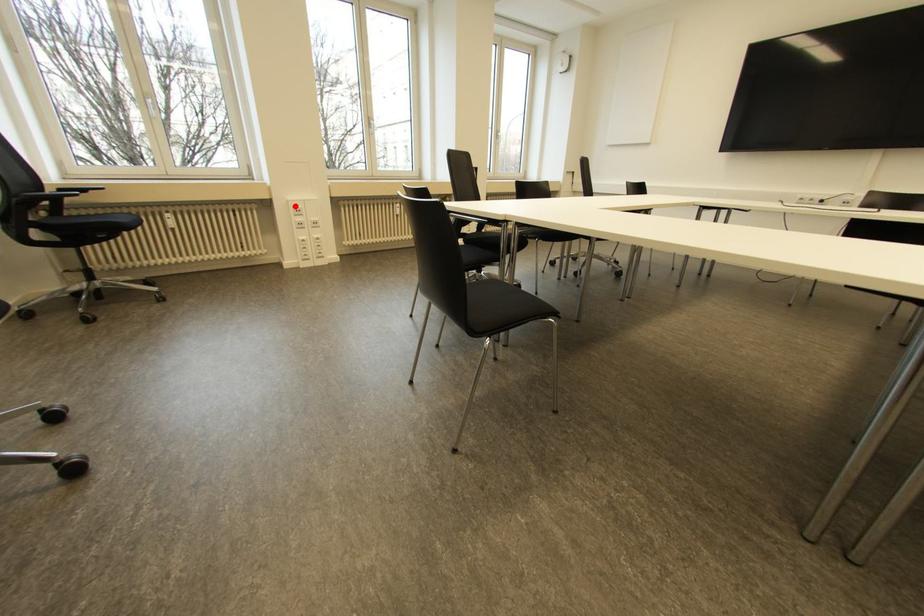
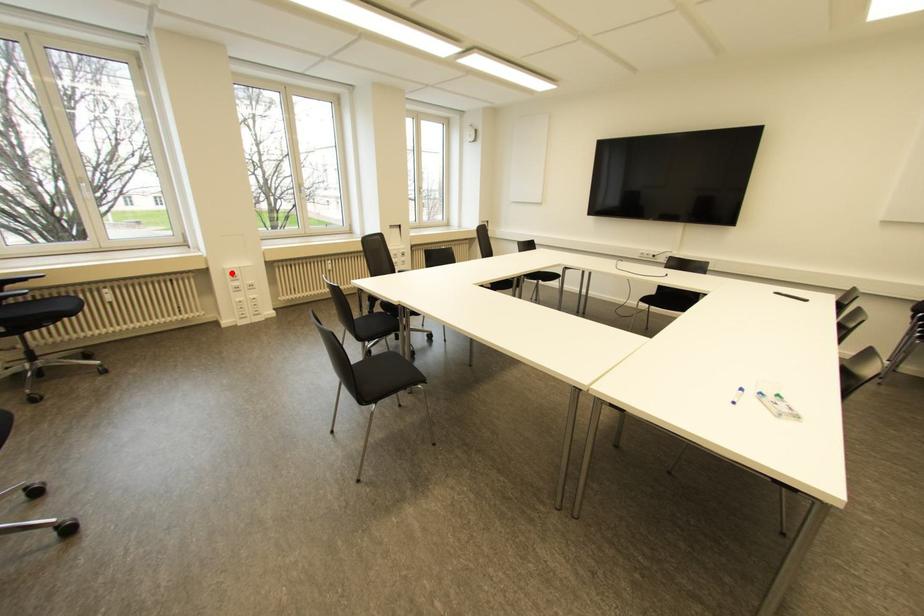
I am providing you with two images of the same scene from different viewpoints. A red point is marked on the first image and another point is marked on the second image. Is the red point in image1 aligned with the point shown in image2?

Yes